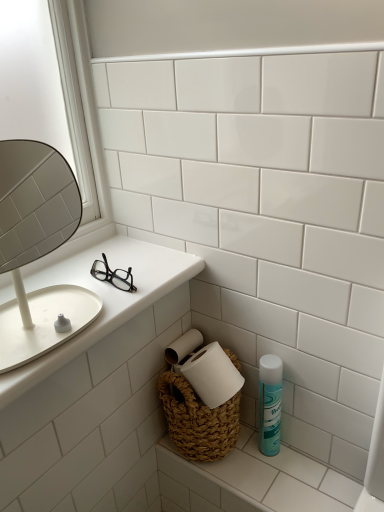
What are the coordinates of `teal matte mouthwash at lower right` in the screenshot? It's located at (270, 404).

The width and height of the screenshot is (384, 512). Describe the element at coordinates (102, 298) in the screenshot. I see `white glossy counter top at left, the 2th counter top in the right-to-left sequence` at that location.

In the scene shown: Measure the distance between point (288, 459) and camera.

They are 1.04 meters apart.

You are a GUI agent. You are given a task and a screenshot of the screen. Output one action in this format:
    pyautogui.click(x=<x>, y=<y>)
    Task: Click on the white matte mirror at left
    
    Given the screenshot: What is the action you would take?
    pyautogui.click(x=37, y=249)

Does point (0, 165) lie in front of point (20, 373)?

No, (0, 165) is behind (20, 373).

Between white matte mirror at left and white glossy counter top at left, which is counted as the first counter top, starting from the top, which one appears on the left side from the viewer's perspective?

white matte mirror at left is more to the left.

Which is correct: white matte mirror at left is inside white glossy counter top at left, which is counted as the first counter top, starting from the top, or outside of it?

white matte mirror at left is not enclosed by white glossy counter top at left, which is counted as the first counter top, starting from the top.

Is white woven basket at lower right, placed as the first counter top when sorted from bottom to top, at the back of teal matte mouthwash at lower right?

No, teal matte mouthwash at lower right is not facing the opposite direction of white woven basket at lower right, placed as the first counter top when sorted from bottom to top.

Are teal matte mouthwash at lower right and white woven basket at lower right, placed as the first counter top when sorted from bottom to top, beside each other?

No, teal matte mouthwash at lower right is not touching white woven basket at lower right, placed as the first counter top when sorted from bottom to top.

Consider the image. Is teal matte mouthwash at lower right located outside white woven basket at lower right, the 1th counter top positioned from the right?

Yes, teal matte mouthwash at lower right is not within white woven basket at lower right, the 1th counter top positioned from the right.

Is teal matte mouthwash at lower right bigger or smaller than white woven basket at lower right, the second counter top from the top?

In the image, teal matte mouthwash at lower right appears to be smaller than white woven basket at lower right, the second counter top from the top.

Which is in front, point (162, 462) or point (273, 387)?

The point (273, 387) is in front.

Considering the sizes of objects white woven basket at lower right, the 1th counter top positioned from the right, and teal matte mouthwash at lower right in the image provided, who is shorter, white woven basket at lower right, the 1th counter top positioned from the right, or teal matte mouthwash at lower right?

white woven basket at lower right, the 1th counter top positioned from the right.

From a real-world perspective, which is physically below, white woven basket at lower right, the 1th counter top positioned from the right, or teal matte mouthwash at lower right?

white woven basket at lower right, the 1th counter top positioned from the right, is physically lower.

Locate an element on the screen. The width and height of the screenshot is (384, 512). counter top located underneath the teal matte mouthwash at lower right (from a real-world perspective) is located at coordinates (251, 481).

From the image's perspective, is teal matte mouthwash at lower right above or below white glossy counter top at left, placed as the second counter top when sorted from bottom to top?

teal matte mouthwash at lower right is situated lower than white glossy counter top at left, placed as the second counter top when sorted from bottom to top, in the image.

Consider the image. Which object is further away from the camera, teal matte mouthwash at lower right or white glossy counter top at left, the 2th counter top in the right-to-left sequence?

teal matte mouthwash at lower right is more distant.

Considering the sizes of teal matte mouthwash at lower right and white glossy counter top at left, the 1th counter top from the left, in the image, is teal matte mouthwash at lower right bigger or smaller than white glossy counter top at left, the 1th counter top from the left,?

Considering their sizes, teal matte mouthwash at lower right takes up less space than white glossy counter top at left, the 1th counter top from the left.

Is there a large distance between teal matte mouthwash at lower right and white glossy counter top at left, the 1th counter top from the left?

teal matte mouthwash at lower right is near white glossy counter top at left, the 1th counter top from the left, not far away.

Consider the image. Is there a large distance between white matte mirror at left and white woven basket at lower right, the second counter top from the top?

No, white matte mirror at left is in close proximity to white woven basket at lower right, the second counter top from the top.

Is white matte mirror at left turned away from white woven basket at lower right, marked as the second counter top in a left-to-right arrangement?

No, white matte mirror at left is not facing the opposite direction of white woven basket at lower right, marked as the second counter top in a left-to-right arrangement.

Consider the image. In terms of width, does white matte mirror at left look wider or thinner when compared to white woven basket at lower right, the second counter top from the top?

In the image, white matte mirror at left appears to be wider than white woven basket at lower right, the second counter top from the top.

Does white matte mirror at left appear on the left side of teal matte mouthwash at lower right?

Correct, you'll find white matte mirror at left to the left of teal matte mouthwash at lower right.

This screenshot has width=384, height=512. Find the location of `mouthwash behind the white matte mirror at left`. mouthwash behind the white matte mirror at left is located at coordinates (270, 404).

How different are the orientations of white matte mirror at left and teal matte mouthwash at lower right in degrees?

The angular difference between white matte mirror at left and teal matte mouthwash at lower right is 86.6 degrees.

Considering the relative sizes of white matte mirror at left and teal matte mouthwash at lower right in the image provided, is white matte mirror at left shorter than teal matte mouthwash at lower right?

No.

Between white glossy counter top at left, placed as the second counter top when sorted from bottom to top, and teal matte mouthwash at lower right, which one is positioned in front?

white glossy counter top at left, placed as the second counter top when sorted from bottom to top, is in front.

Measure the distance between white glossy counter top at left, placed as the second counter top when sorted from bottom to top, and teal matte mouthwash at lower right.

They are 16.09 inches apart.

Is white glossy counter top at left, which is counted as the first counter top, starting from the top, facing towards teal matte mouthwash at lower right?

No, white glossy counter top at left, which is counted as the first counter top, starting from the top, is not aimed at teal matte mouthwash at lower right.

The width and height of the screenshot is (384, 512). What are the coordinates of `mirror on the left of white glossy counter top at left, the 1th counter top from the left` in the screenshot? It's located at (37, 249).

In the image, there is a white woven basket at lower right, placed as the first counter top when sorted from bottom to top. Identify the location of mouthwash above it (from the image's perspective). click(x=270, y=404).

From the image, which object appears to be farther from teal matte mouthwash at lower right, white woven basket at lower right, marked as the second counter top in a left-to-right arrangement, or white matte mirror at left?

Based on the image, white matte mirror at left appears to be further to teal matte mouthwash at lower right.

Which object lies further to the anchor point white matte mirror at left, white glossy counter top at left, placed as the second counter top when sorted from bottom to top, or teal matte mouthwash at lower right?

The object further to white matte mirror at left is teal matte mouthwash at lower right.

Which object lies nearer to the anchor point white glossy counter top at left, placed as the second counter top when sorted from bottom to top, white matte mirror at left or white woven basket at lower right, the second counter top from the top?

The object closer to white glossy counter top at left, placed as the second counter top when sorted from bottom to top, is white matte mirror at left.

When comparing their distances from white woven basket at lower right, the 1th counter top positioned from the right, does teal matte mouthwash at lower right or white matte mirror at left seem further?

white matte mirror at left is further to white woven basket at lower right, the 1th counter top positioned from the right.

Considering their positions, is teal matte mouthwash at lower right positioned closer to white glossy counter top at left, which is counted as the first counter top, starting from the top, than white woven basket at lower right, the second counter top from the top?

teal matte mouthwash at lower right lies closer to white glossy counter top at left, which is counted as the first counter top, starting from the top, than the other object.

From the image, which object appears to be nearer to white matte mirror at left, white woven basket at lower right, marked as the second counter top in a left-to-right arrangement, or white glossy counter top at left, placed as the second counter top when sorted from bottom to top?

Among the two, white glossy counter top at left, placed as the second counter top when sorted from bottom to top, is located nearer to white matte mirror at left.

Based on their spatial positions, is white woven basket at lower right, the 1th counter top positioned from the right, or white glossy counter top at left, the 2th counter top in the right-to-left sequence, closer to teal matte mouthwash at lower right?

white woven basket at lower right, the 1th counter top positioned from the right, is positioned closer to the anchor teal matte mouthwash at lower right.

Which object lies nearer to the anchor point white woven basket at lower right, placed as the first counter top when sorted from bottom to top, white matte mirror at left or white glossy counter top at left, placed as the second counter top when sorted from bottom to top?

Among the two, white glossy counter top at left, placed as the second counter top when sorted from bottom to top, is located nearer to white woven basket at lower right, placed as the first counter top when sorted from bottom to top.

Identify the location of mouthwash that lies between white matte mirror at left and white woven basket at lower right, the 1th counter top positioned from the right, from top to bottom. (270, 404).

Where is `counter top between white matte mirror at left and white woven basket at lower right, the 1th counter top positioned from the right, from top to bottom`? This screenshot has width=384, height=512. counter top between white matte mirror at left and white woven basket at lower right, the 1th counter top positioned from the right, from top to bottom is located at coordinates (102, 298).

You are a GUI agent. You are given a task and a screenshot of the screen. Output one action in this format:
    pyautogui.click(x=<x>, y=<y>)
    Task: Click on the counter top between white glossy counter top at left, the 1th counter top from the left, and teal matte mouthwash at lower right from left to right
    This screenshot has height=512, width=384.
    Given the screenshot: What is the action you would take?
    pyautogui.click(x=251, y=481)